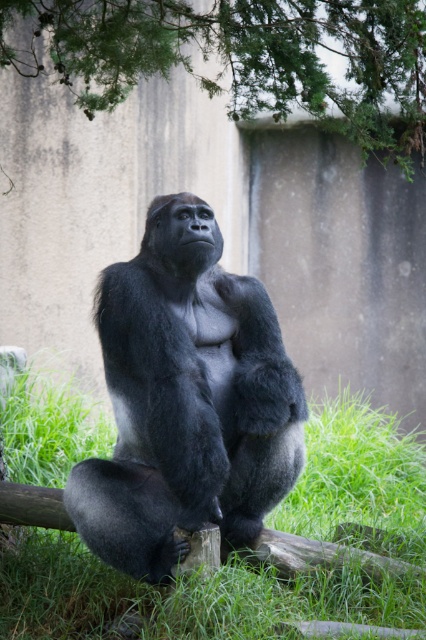
Question: Which of the following is the farthest from the observer?

Choices:
 (A) shiny black gorilla at center
 (B) green leafy tree at upper center

Answer: (A)

Question: Which object appears farthest from the camera in this image?

Choices:
 (A) green leafy tree at upper center
 (B) green grass at lower center

Answer: (B)

Question: Is shiny black gorilla at center smaller than green leafy tree at upper center?

Choices:
 (A) no
 (B) yes

Answer: (B)

Question: Among these points, which one is nearest to the camera?

Choices:
 (A) (296, 413)
 (B) (399, 138)
 (C) (348, 618)

Answer: (C)

Question: Can you confirm if shiny black gorilla at center is positioned to the right of green leafy tree at upper center?

Choices:
 (A) no
 (B) yes

Answer: (A)

Question: Is green grass at lower center below green leafy tree at upper center?

Choices:
 (A) yes
 (B) no

Answer: (A)